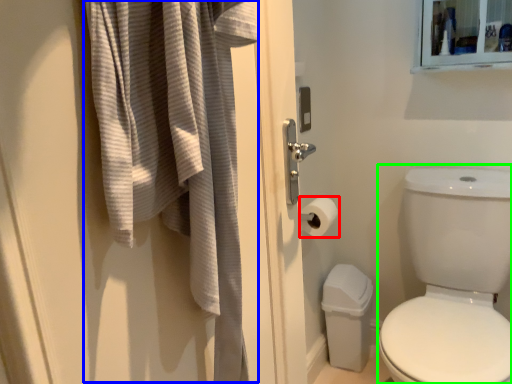
Question: Which is nearer to the toilet paper (highlighted by a red box)? bath towel (highlighted by a blue box) or toilet bowl (highlighted by a green box).

Choices:
 (A) bath towel
 (B) toilet bowl

Answer: (B)